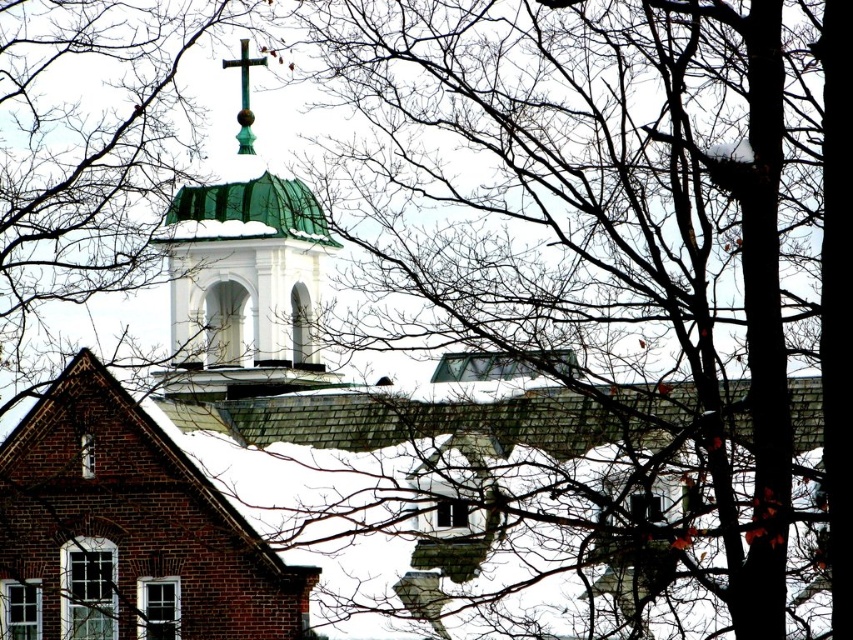
You are an architect analyzing the winter scene. You notice the brick church at center and the green patinated metal cross at upper center. Which object appears bigger in the image?

The brick church at center is larger in size compared to the green patinated metal cross at upper center.

You are standing in a snowy winter landscape and see the brick church at center and the green patinated metal cross at upper center. Which object is positioned more to the right side of the image?

The green patinated metal cross at upper center is positioned more to the right side of the image because the brick church at center is to the left of it.

You are standing at the base of the brick church at center and want to place a 10 meter long decorative banner between it and the green patinated metal cross at upper center. Will the banner be long enough to stretch between them?

The distance between the brick church at center and the green patinated metal cross at upper center is 37.14 meters. Since the banner is only 10 meters long, it will not be long enough to stretch between them.